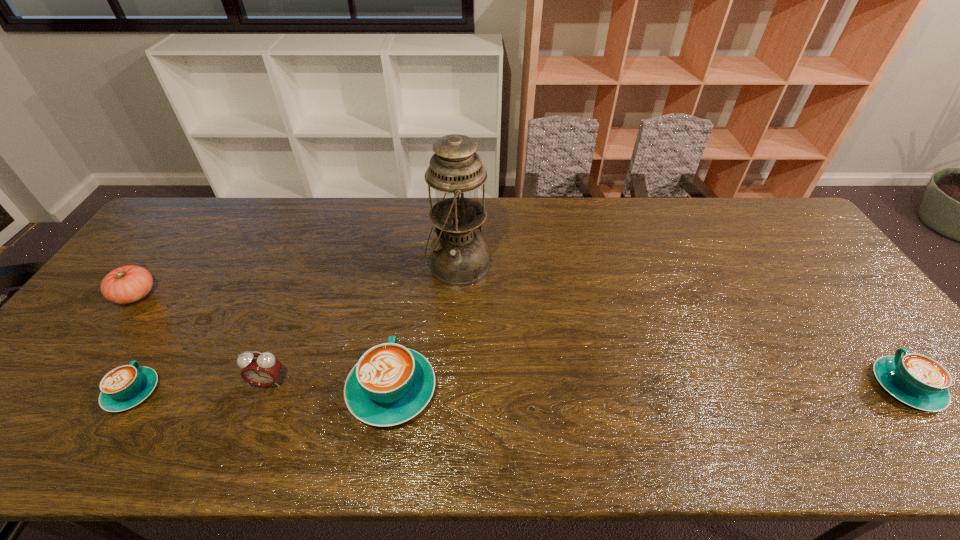
Identify which object is the third closest to the rightmost cappuccino. Please provide its 2D coordinates. Your answer should be formatted as a tuple, i.e. [(x, y)], where the tuple contains the x and y coordinates of a point satisfying the conditions above.

[(261, 369)]

Identify which cappuccino is the third nearest to the tomato. Please provide its 2D coordinates. Your answer should be formatted as a tuple, i.e. [(x, y)], where the tuple contains the x and y coordinates of a point satisfying the conditions above.

[(914, 379)]

Identify which cappuccino is located as the third nearest to the alarm clock. Please provide its 2D coordinates. Your answer should be formatted as a tuple, i.e. [(x, y)], where the tuple contains the x and y coordinates of a point satisfying the conditions above.

[(914, 379)]

I want to click on free space that satisfies the following two spatial constraints: 1. with the handle on the right side of the leftmost cappuccino; 2. on the left side of the tallest object, so click(x=211, y=266).